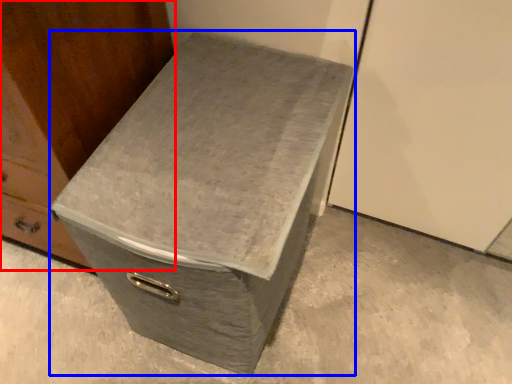
Question: Which object appears farthest to the camera in this image, furniture (highlighted by a red box) or shoe box (highlighted by a blue box)?

Choices:
 (A) furniture
 (B) shoe box

Answer: (B)